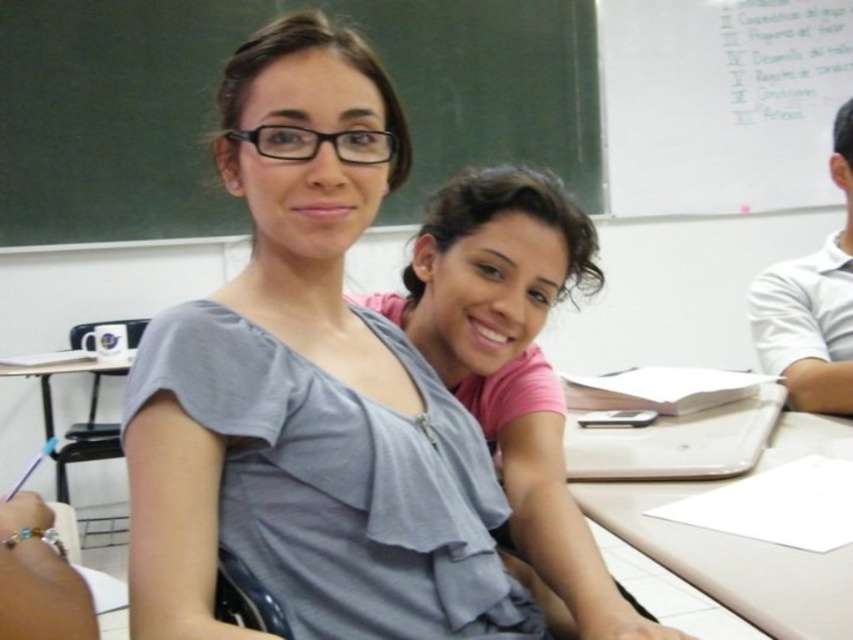
Question: Is matte gray blouse at center to the right of pink matte shirt at center from the viewer's perspective?

Choices:
 (A) yes
 (B) no

Answer: (B)

Question: Which point is farther to the camera?

Choices:
 (A) metallic silver table at left
 (B) white shirt at right
 (C) white plastic table at center

Answer: (A)

Question: Is green chalkboard at upper center thinner than metallic silver table at left?

Choices:
 (A) yes
 (B) no

Answer: (B)

Question: Which of the following is the closest to the observer?

Choices:
 (A) metallic silver table at left
 (B) green chalkboard at upper center

Answer: (A)

Question: Which of the following is the farthest from the observer?

Choices:
 (A) (45, 372)
 (B) (364, 125)

Answer: (A)

Question: Does pink matte shirt at center have a greater width compared to white shirt at right?

Choices:
 (A) no
 (B) yes

Answer: (B)